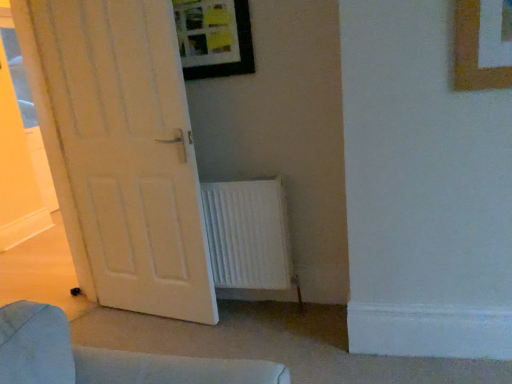
What do you see at coordinates (214, 38) in the screenshot? I see `wooden-framed picture at upper center` at bounding box center [214, 38].

This screenshot has width=512, height=384. I want to click on wooden-framed picture at upper center, so click(x=214, y=38).

At what (x,y) coordinates should I click in order to perform the action: click on picture frame lying on the left of white textured radiator at lower center. Please return your answer as a coordinate pair (x, y). This screenshot has width=512, height=384. Looking at the image, I should click on (214, 38).

Is wooden-framed picture at upper center wider or thinner than white textured radiator at lower center?

In the image, wooden-framed picture at upper center appears to be more narrow than white textured radiator at lower center.

Based on the photo, how different are the orientations of wooden-framed picture at upper center and white textured radiator at lower center in degrees?

1.17 degrees.

Is wooden-framed picture at upper center taller than white textured radiator at lower center?

No, wooden-framed picture at upper center is not taller than white textured radiator at lower center.

Which is more distant, (280, 201) or (241, 43)?

The point (280, 201) is more distant.

Between white textured radiator at lower center and wooden-framed picture at upper center, which one has larger size?

white textured radiator at lower center is bigger.

Is white textured radiator at lower center beside wooden-framed picture at upper center?

They are not placed beside each other.

Which of these two, white matte door at left or wooden-framed picture at upper center, is thinner?

wooden-framed picture at upper center.

Does point (182, 115) appear closer or farther from the camera than point (208, 61)?

Point (182, 115) is positioned closer to the camera compared to point (208, 61).

From a real-world perspective, which object rests below the other?

In real-world perspective, white matte door at left is lower.

From the picture: Between white matte door at left and wooden-framed picture at upper center, which one has smaller size?

Smaller between the two is wooden-framed picture at upper center.

Looking at this image, are white textured radiator at lower center and white matte door at left beside each other?

No, white textured radiator at lower center is not touching white matte door at left.

Where is `radiator below the white matte door at left (from a real-world perspective)`? The width and height of the screenshot is (512, 384). radiator below the white matte door at left (from a real-world perspective) is located at coordinates (248, 234).

From a real-world perspective, is white textured radiator at lower center under white matte door at left?

Indeed, from a real-world perspective, white textured radiator at lower center is positioned beneath white matte door at left.

Is white textured radiator at lower center aimed at white matte door at left?

No, white textured radiator at lower center is not oriented towards white matte door at left.

Is wooden-framed picture at upper center facing towards white matte door at left?

No, wooden-framed picture at upper center is not oriented towards white matte door at left.

Which of these two, wooden-framed picture at upper center or white matte door at left, is smaller?

Smaller between the two is wooden-framed picture at upper center.

From a real-world perspective, is wooden-framed picture at upper center below white matte door at left?

No.

Is wooden-framed picture at upper center not inside white matte door at left?

Yes.

Is white matte door at left inside the boundaries of white textured radiator at lower center, or outside?

white matte door at left is outside white textured radiator at lower center.

Which of these two, white matte door at left or white textured radiator at lower center, stands shorter?

Standing shorter between the two is white textured radiator at lower center.

Is white matte door at left positioned with its back to white textured radiator at lower center?

That's not correct — white matte door at left is not looking away from white textured radiator at lower center.

Which is more to the right, white matte door at left or white textured radiator at lower center?

white textured radiator at lower center is more to the right.

Where is `picture frame above the white textured radiator at lower center (from the image's perspective)`? picture frame above the white textured radiator at lower center (from the image's perspective) is located at coordinates (214, 38).

You are a GUI agent. You are given a task and a screenshot of the screen. Output one action in this format:
    pyautogui.click(x=<x>, y=<y>)
    Task: Click on the radiator located underneath the wooden-framed picture at upper center (from a real-world perspective)
    This screenshot has height=384, width=512.
    Given the screenshot: What is the action you would take?
    pyautogui.click(x=248, y=234)

Based on their spatial positions, is white textured radiator at lower center or wooden-framed picture at upper center further from white matte door at left?

The object further to white matte door at left is wooden-framed picture at upper center.

From the image, which object appears to be farther from white textured radiator at lower center, wooden-framed picture at upper center or white matte door at left?

wooden-framed picture at upper center is further to white textured radiator at lower center.

Estimate the real-world distances between objects in this image. Which object is closer to white matte door at left, wooden-framed picture at upper center or white textured radiator at lower center?

white textured radiator at lower center lies closer to white matte door at left than the other object.

Looking at the image, which one is located closer to wooden-framed picture at upper center, white textured radiator at lower center or white matte door at left?

white matte door at left lies closer to wooden-framed picture at upper center than the other object.

When comparing their distances from white textured radiator at lower center, does white matte door at left or wooden-framed picture at upper center seem further?

Among the two, wooden-framed picture at upper center is located further to white textured radiator at lower center.

From the image, which object appears to be farther from wooden-framed picture at upper center, white matte door at left or white textured radiator at lower center?

white textured radiator at lower center is positioned further to the anchor wooden-framed picture at upper center.

Locate an element on the screen. The image size is (512, 384). door that lies between wooden-framed picture at upper center and white textured radiator at lower center from top to bottom is located at coordinates (129, 152).